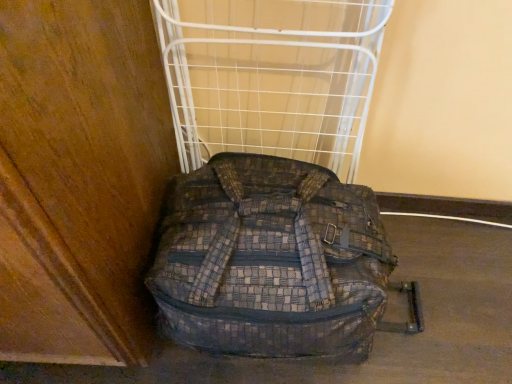
Find the location of a particular element. The width and height of the screenshot is (512, 384). unoccupied region to the right of plaid fabric backpack at center is located at coordinates (455, 286).